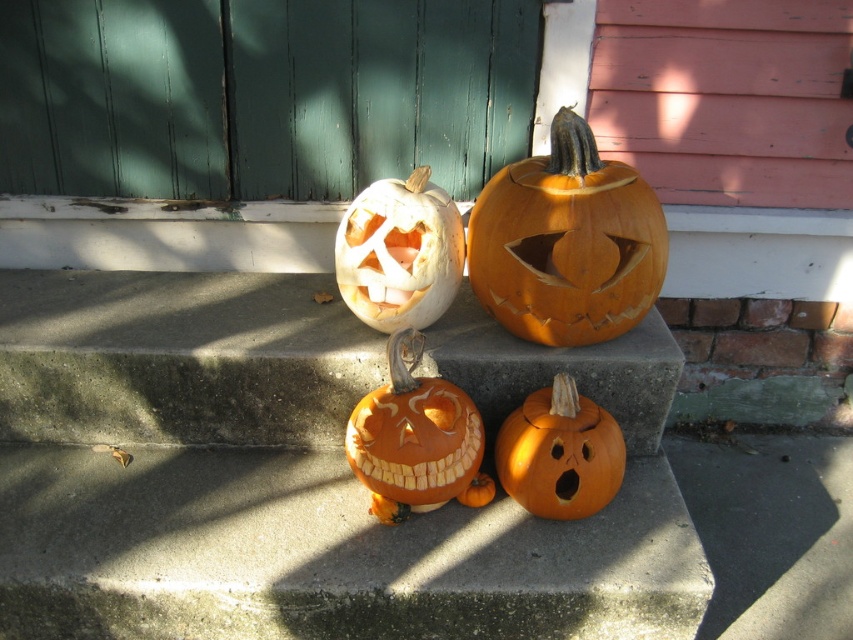
Does orange matte carved pumpkin at center have a smaller size compared to orange matte pumpkin at center?

Actually, orange matte carved pumpkin at center might be larger than orange matte pumpkin at center.

Identify the location of orange matte carved pumpkin at center. (416, 440).

Is point (422, 483) positioned in front of point (355, 308)?

Yes.

Is orange matte carved pumpkin at center thinner than white matte carved pumpkin at center?

In fact, orange matte carved pumpkin at center might be wider than white matte carved pumpkin at center.

What do you see at coordinates (416, 440) in the screenshot? I see `orange matte carved pumpkin at center` at bounding box center [416, 440].

Where is `orange matte carved pumpkin at center`? Image resolution: width=853 pixels, height=640 pixels. orange matte carved pumpkin at center is located at coordinates (416, 440).

Looking at this image, does white matte carved pumpkin at center have a greater width compared to orange matte pumpkin at center?

Yes, white matte carved pumpkin at center is wider than orange matte pumpkin at center.

Is white matte carved pumpkin at center above orange matte pumpkin at center?

Yes.

Is point (374, 272) closer to viewer compared to point (556, 376)?

No, (374, 272) is further to viewer.

Where is `white matte carved pumpkin at center`? white matte carved pumpkin at center is located at coordinates (399, 252).